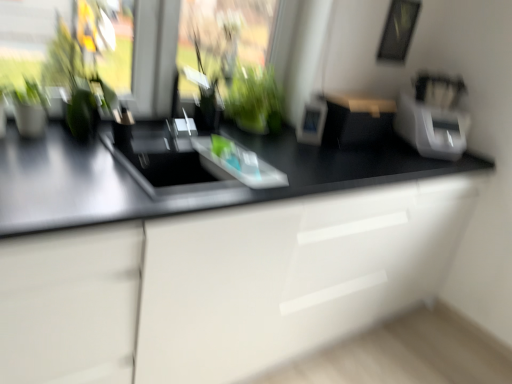
Question: From the image's perspective, is green glossy plant at center above or below white plastic knife block at right, which ranks as the first appliance in right-to-left order?

Choices:
 (A) above
 (B) below

Answer: (A)

Question: Looking at the image, does green glossy plant at center seem bigger or smaller compared to white plastic knife block at right, the 3th appliance in the left-to-right sequence?

Choices:
 (A) small
 (B) big

Answer: (A)

Question: Considering the real-world distances, which object is closest to the transparent glass window screen at upper left, positioned as the second window screen in right-to-left order?

Choices:
 (A) green glass vase at center, marked as the 2th window screen in a left-to-right arrangement
 (B) green glossy plant at center
 (C) white plastic photo frame at center, arranged as the third appliance when viewed from the right
 (D) matte black box at center, which is the 2th appliance in right-to-left order
 (E) white plastic knife block at right, the 3th appliance in the left-to-right sequence

Answer: (A)

Question: Considering the real-world distances, which object is farthest from the green glass vase at center, which ranks as the 1th window screen in right-to-left order?

Choices:
 (A) white glossy cabinet at center
 (B) white plastic photo frame at center, the 1th appliance positioned from the left
 (C) matte black box at center, the second appliance when ordered from left to right
 (D) transparent glass window screen at upper left, positioned as the second window screen in right-to-left order
 (E) white plastic knife block at right, the 3th appliance in the left-to-right sequence

Answer: (D)